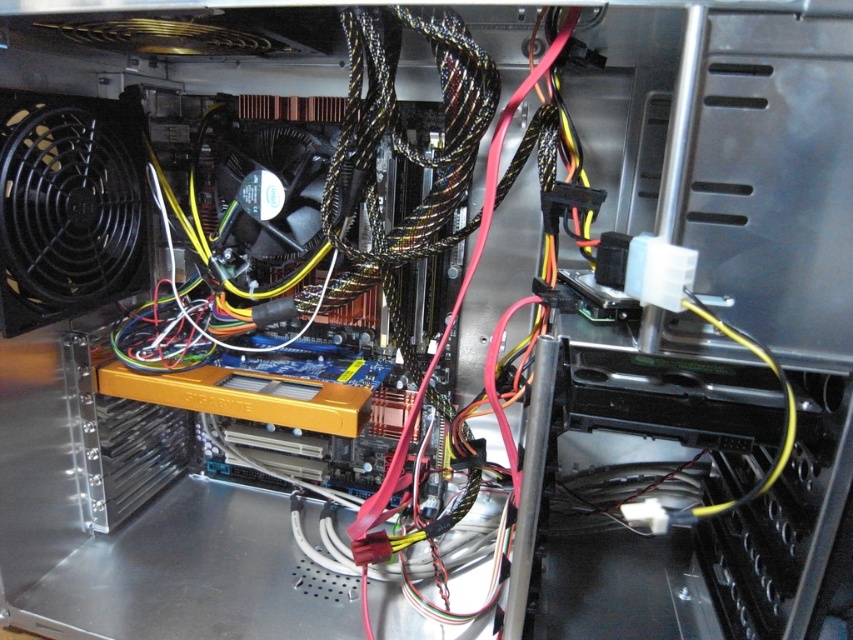
You are setting up a new computer and need to install a cable that requires 25 centimeters of space between the two black plastic fans. Based on the image, is there enough space between the black plastic fan at left and the black plastic fan at center?

The black plastic fan at left and black plastic fan at center are 20.73 centimeters apart, which is less than the required 25 centimeters. Therefore, there is not enough space between them for the cable installation.

You are a technician inside the computer case and need to access both the point at coordinates point (10, 131) and point (228, 276). Which point is closer to you when you first open the case?

Point (10, 131) is in front of point (228, 276), so you will reach point (10, 131) first.

You are setting up a new computer and need to identify the position of the fans. According to the image, which fan is located lower in the case, the black plastic fan at left or the black plastic fan at center?

The black plastic fan at left is below the black plastic fan at center, so the black plastic fan at left is located lower in the case.